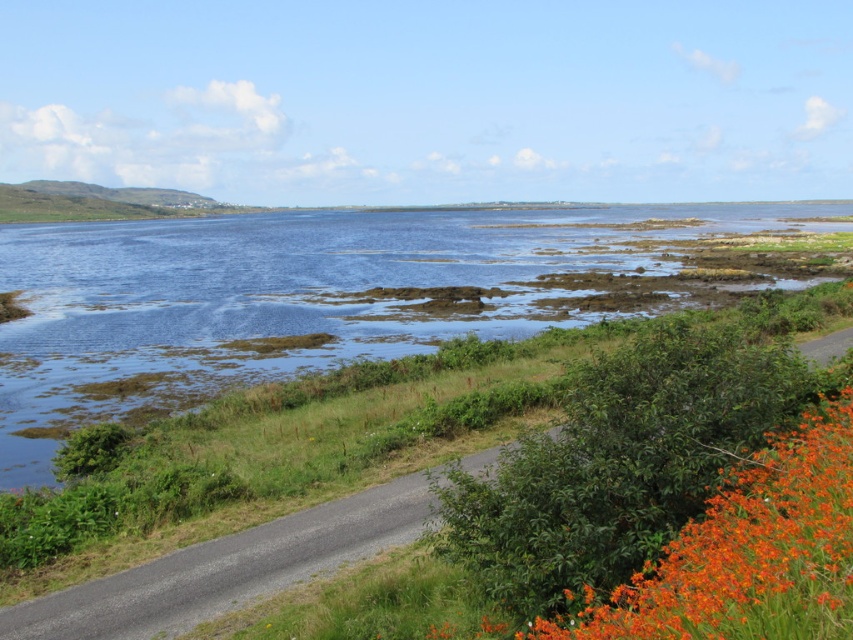
Question: Is blue water at center wider than orange matte flowers at lower right?

Choices:
 (A) yes
 (B) no

Answer: (A)

Question: Can you confirm if blue water at center is thinner than orange matte flowers at lower right?

Choices:
 (A) yes
 (B) no

Answer: (B)

Question: Is blue water at center above orange matte flowers at lower right?

Choices:
 (A) yes
 (B) no

Answer: (A)